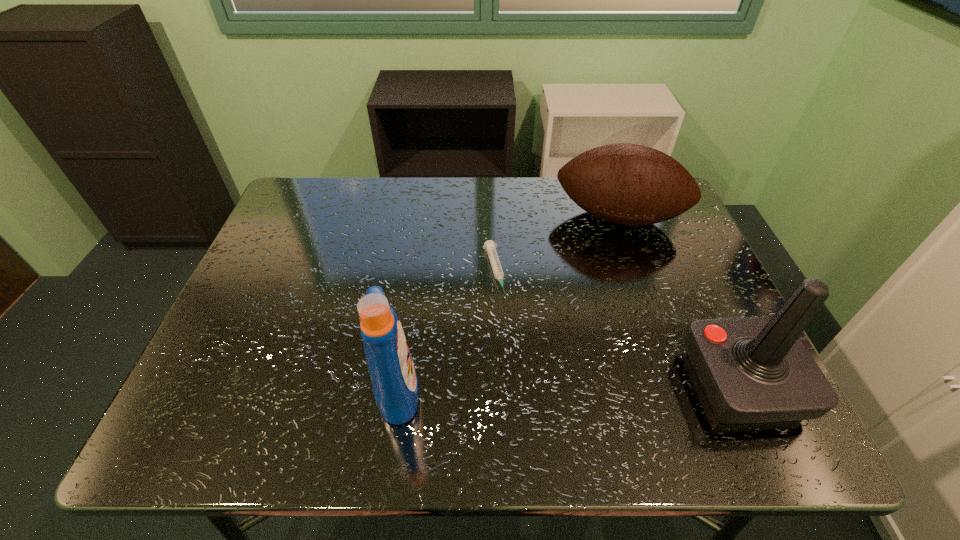
Where is `vacant space situated at the needle end of the syringe`? vacant space situated at the needle end of the syringe is located at coordinates (525, 397).

Find the location of a particular element. The width and height of the screenshot is (960, 540). free region located 0.180m on the laces of the football is located at coordinates (607, 292).

Locate an element on the screen. vacant space located on the laces of the football is located at coordinates (606, 301).

Where is `free space located 0.370m on the laces of the football`? The width and height of the screenshot is (960, 540). free space located 0.370m on the laces of the football is located at coordinates (601, 356).

You are a GUI agent. You are given a task and a screenshot of the screen. Output one action in this format:
    pyautogui.click(x=<x>, y=<y>)
    Task: Click on the object located in the far edge section of the desktop
    
    Given the screenshot: What is the action you would take?
    pyautogui.click(x=629, y=184)

Where is `detergent present at the near edge`? detergent present at the near edge is located at coordinates (395, 386).

Where is `joystick that is at the near edge`? joystick that is at the near edge is located at coordinates (752, 369).

Identify the location of joystick situated at the right edge. The image size is (960, 540). (752, 369).

Where is `football located at the right edge`? football located at the right edge is located at coordinates (629, 184).

Locate an element on the screen. object present at the far right corner is located at coordinates (629, 184).